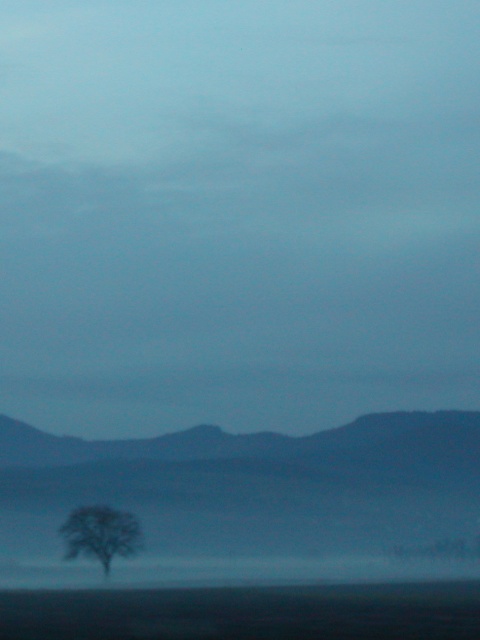
You are an explorer trying to navigate through the misty landscape. You see the dark gray textured mountain at lower left and the silvery gray tree at lower left. Which object is positioned more to the east if you assume the image is oriented with the horizon line as north?

The dark gray textured mountain at lower left is to the right of the silvery gray tree at lower left. Since the image is oriented with the horizon as north, the mountain would be positioned more to the east compared to the tree.

You are standing at the point marked by the coordinates point (244, 497) in the image. What object is directly beneath your feet?

The point (244, 497) corresponds to the dark gray textured mountain at lower left, so the dark gray textured mountain at lower left is directly beneath your feet.